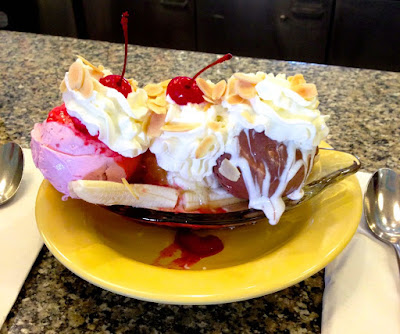
Where is `spoons`? spoons is located at coordinates [383, 217], [10, 171].